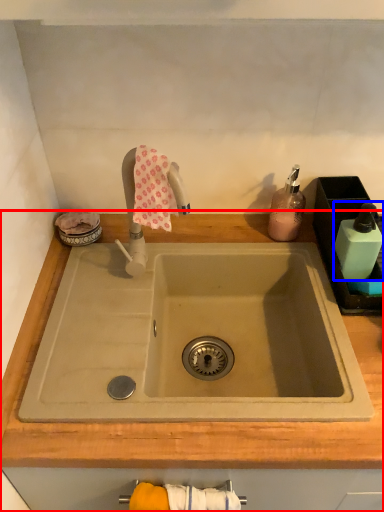
Question: Which object appears closest to the camera in this image, countertop (highlighted by a red box) or toiletry (highlighted by a blue box)?

Choices:
 (A) countertop
 (B) toiletry

Answer: (A)